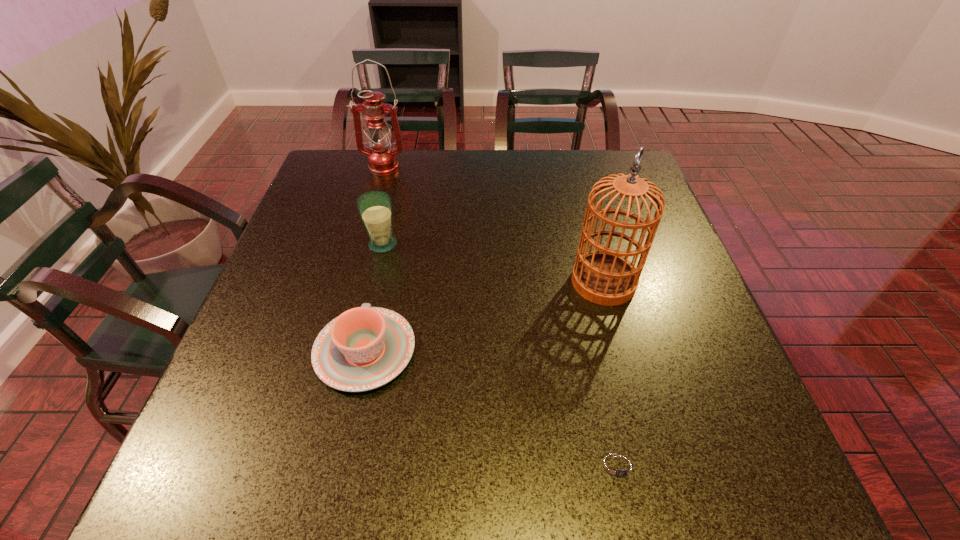
Image resolution: width=960 pixels, height=540 pixels. What are the coordinates of `birdcage` in the screenshot? It's located at (606, 277).

In order to click on the farthest object in this screenshot , I will do `click(382, 159)`.

I want to click on the fourth nearest object, so click(375, 207).

Locate an element on the screen. This screenshot has height=540, width=960. glass is located at coordinates (375, 207).

Image resolution: width=960 pixels, height=540 pixels. I want to click on the fourth farthest object, so (x=366, y=347).

Locate an element on the screen. This screenshot has height=540, width=960. the fourth tallest object is located at coordinates (366, 347).

The width and height of the screenshot is (960, 540). Identify the location of watch. (619, 467).

Locate an element on the screen. the shortest object is located at coordinates (619, 467).

The image size is (960, 540). In order to click on vacant position located 0.280m on the front of the birdcage in this screenshot , I will do `click(643, 429)`.

The height and width of the screenshot is (540, 960). Identify the location of free location located 0.260m on the front of the farthest object. (365, 233).